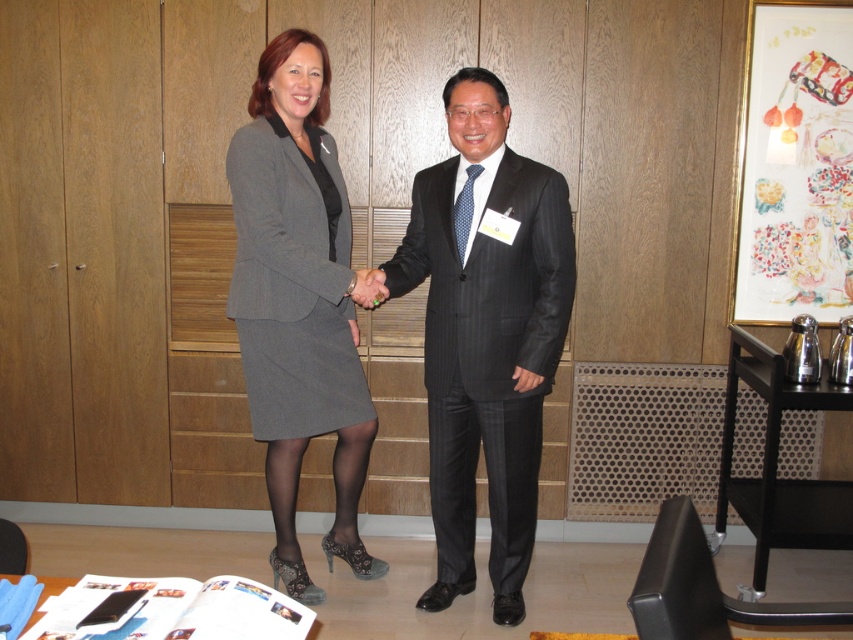
Question: Considering the relative positions of dark gray pinstripe suit at center and matte black hand at center in the image provided, where is dark gray pinstripe suit at center located with respect to matte black hand at center?

Choices:
 (A) above
 (B) below

Answer: (B)

Question: Can you confirm if gray wool skirt at center is positioned above matte black hand at center?

Choices:
 (A) no
 (B) yes

Answer: (A)

Question: Considering the real-world distances, which object is farthest from the gray wool skirt at center?

Choices:
 (A) dark gray pinstripe suit at center
 (B) matte black hand at center

Answer: (A)

Question: Is gray wool skirt at center above matte black hand at center?

Choices:
 (A) no
 (B) yes

Answer: (A)

Question: Which of the following is the closest to the observer?

Choices:
 (A) (521, 212)
 (B) (326, 100)

Answer: (A)

Question: Estimate the real-world distances between objects in this image. Which object is closer to the dark gray pinstripe suit at center?

Choices:
 (A) matte black hand at center
 (B) gray wool skirt at center

Answer: (B)